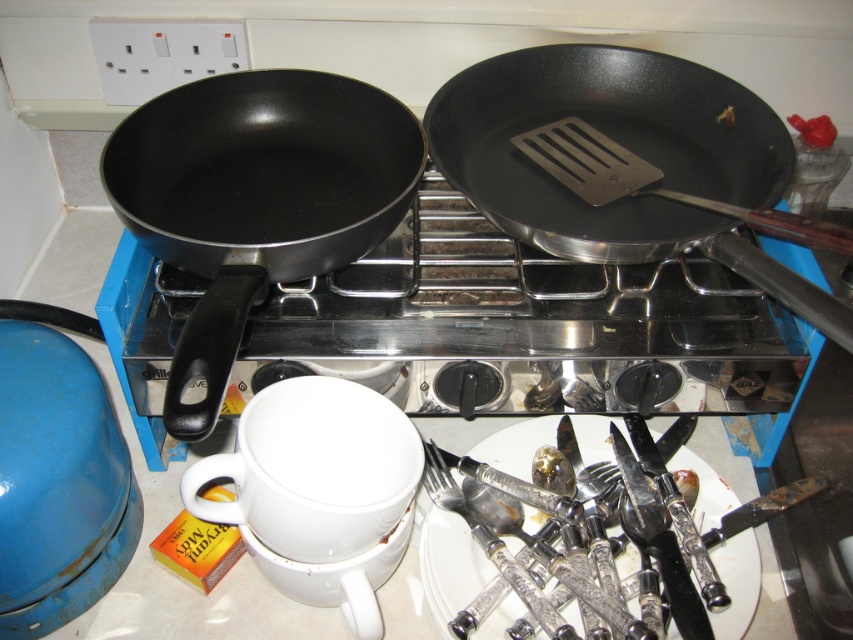
Question: Where is matte black frying pan at upper right located in relation to metallic silver spatula at upper right in the image?

Choices:
 (A) below
 (B) above

Answer: (A)

Question: Which of the following is the closest to the observer?

Choices:
 (A) metallic silver spatula at upper right
 (B) matte black frying pan at upper right

Answer: (B)

Question: Among these points, which one is nearest to the camera?

Choices:
 (A) (187, 202)
 (B) (566, 156)
 (C) (682, 465)

Answer: (A)

Question: Considering the real-world distances, which object is farthest from the matte black frying pan at upper right?

Choices:
 (A) polished silverware at center
 (B) black matte pan at upper left

Answer: (A)

Question: Does matte black frying pan at left have a greater width compared to polished silverware at center?

Choices:
 (A) yes
 (B) no

Answer: (B)

Question: Can you confirm if matte black frying pan at upper right is positioned to the right of polished silverware at center?

Choices:
 (A) yes
 (B) no

Answer: (A)